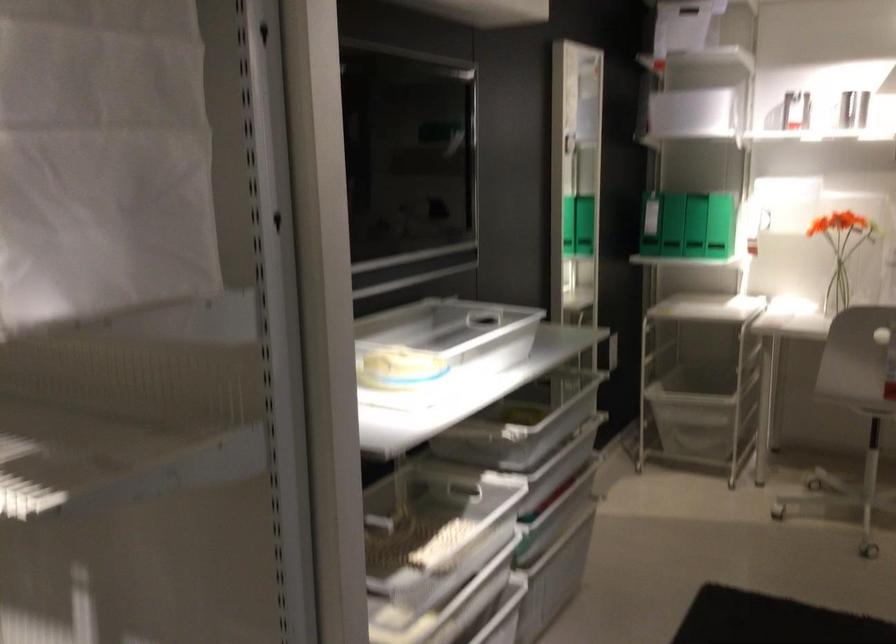
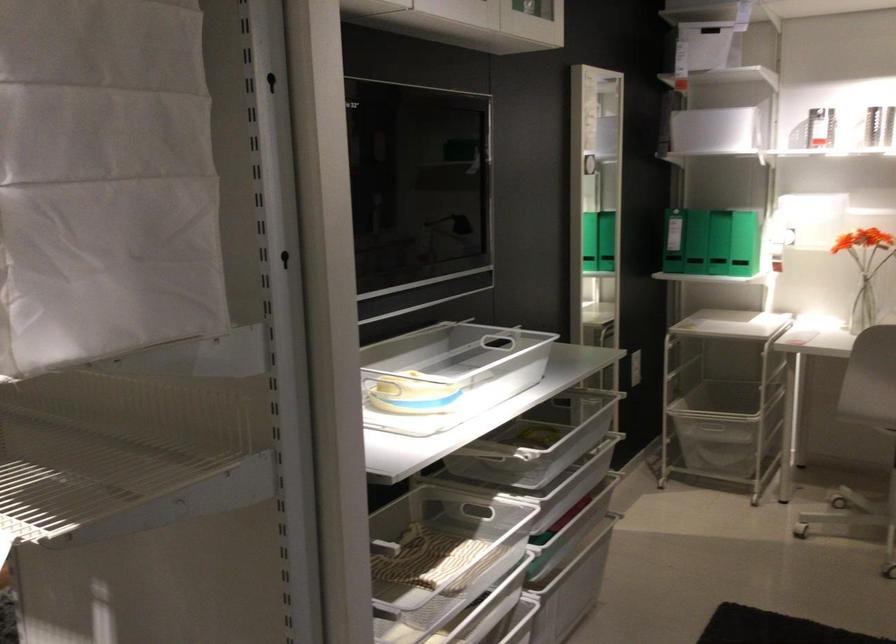
Find the pixel in the second image that matches point (93, 421) in the first image.

(108, 444)